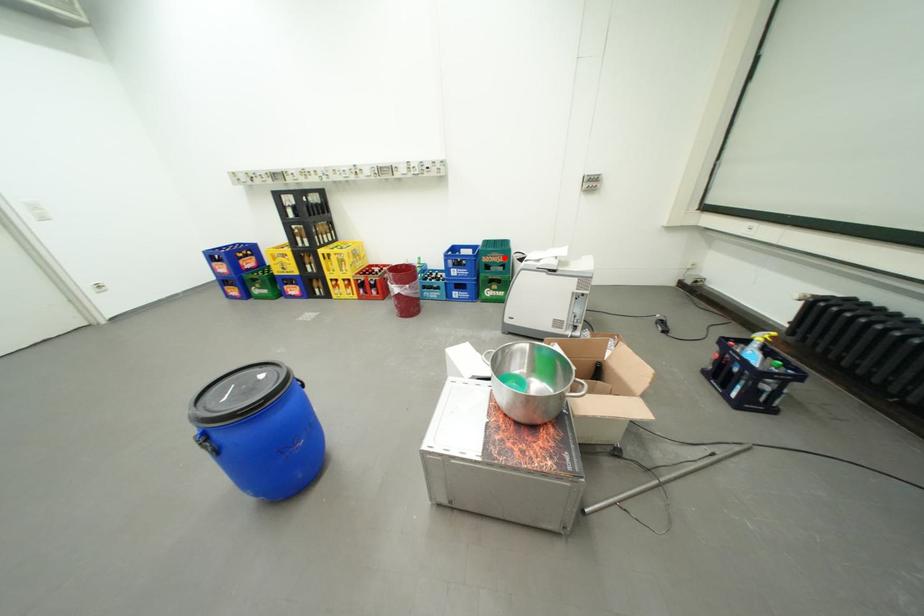
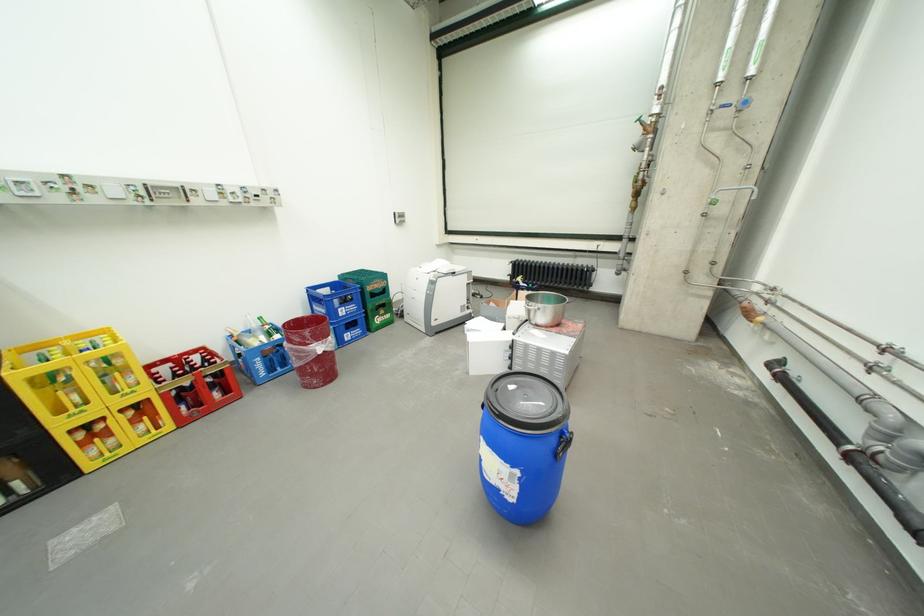
Locate, in the second image, the point that corresponds to the highlighted location in the first image.

(386, 285)